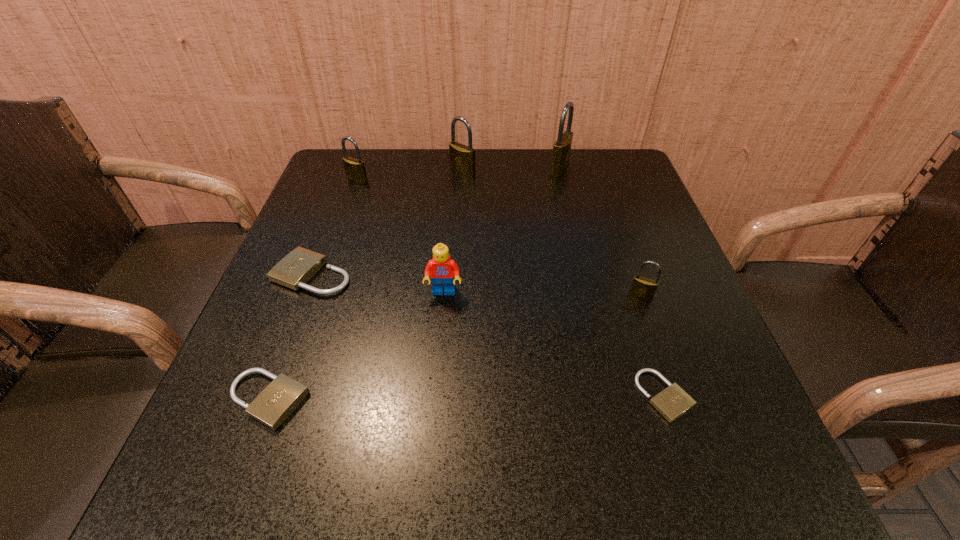
Where is `vacant region located 0.210m on the back of the biggest beige padlock`? The image size is (960, 540). vacant region located 0.210m on the back of the biggest beige padlock is located at coordinates (343, 196).

Where is `blank area located 0.330m on the back of the seventh tallest object`? This screenshot has width=960, height=540. blank area located 0.330m on the back of the seventh tallest object is located at coordinates (327, 241).

This screenshot has width=960, height=540. I want to click on free location located 0.340m on the back of the shortest object, so (612, 239).

You are a GUI agent. You are given a task and a screenshot of the screen. Output one action in this format:
    pyautogui.click(x=<x>, y=<y>)
    Task: Click on the object that is at the far left corner
    The image size is (960, 540).
    Given the screenshot: What is the action you would take?
    pyautogui.click(x=355, y=170)

Find the location of `free region at the far edge`. free region at the far edge is located at coordinates (389, 168).

The height and width of the screenshot is (540, 960). In order to click on vacant space at the left edge in this screenshot , I will do `click(275, 307)`.

Where is `blank area at the right edge`? blank area at the right edge is located at coordinates (635, 200).

Locate an element on the screen. The width and height of the screenshot is (960, 540). vacant region at the far left corner of the desktop is located at coordinates (364, 151).

In the image, there is a desktop. Where is `free region at the near left corner`? This screenshot has width=960, height=540. free region at the near left corner is located at coordinates (198, 474).

Identify the location of unoccupied position between the third biggest brass padlock and the farthest beige padlock. The image size is (960, 540). (335, 227).